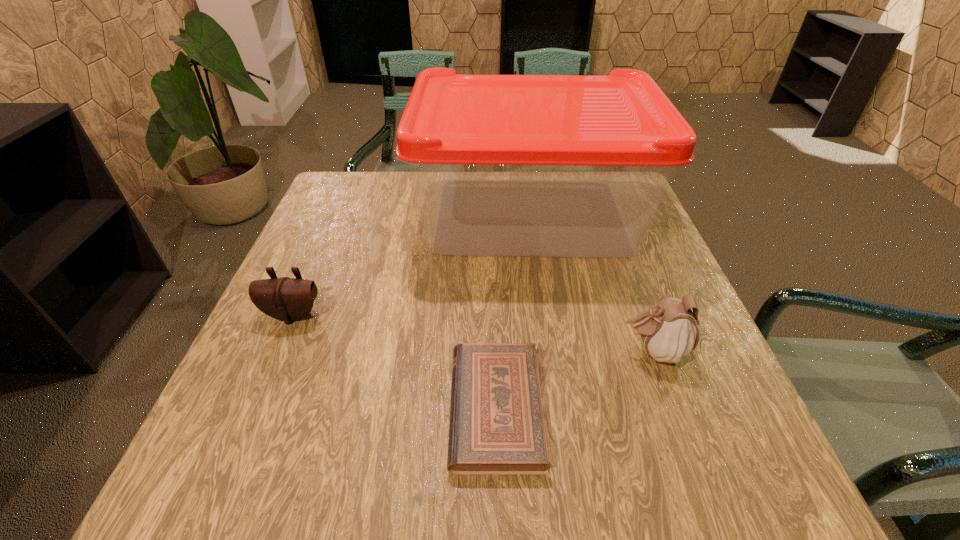
At what (x,y) coordinates should I click in order to perform the action: click on object at the far right corner. Please return your answer as a coordinate pair (x, y). Looking at the image, I should click on (503, 165).

This screenshot has height=540, width=960. I want to click on free space at the far edge of the desktop, so click(x=403, y=206).

Find the location of a particular element. The height and width of the screenshot is (540, 960). vacant space at the left edge of the desktop is located at coordinates (312, 363).

The image size is (960, 540). I want to click on vacant region at the right edge of the desktop, so click(635, 299).

In the image, there is a desktop. Where is `vacant space at the far left corner`? This screenshot has width=960, height=540. vacant space at the far left corner is located at coordinates (354, 185).

Locate an element on the screen. The height and width of the screenshot is (540, 960). vacant space at the near right corner of the desktop is located at coordinates (706, 469).

Where is `empty location between the taller pouch and the second shortest object`? empty location between the taller pouch and the second shortest object is located at coordinates (473, 333).

Locate an element on the screen. vacant space that is in between the second farthest object and the tray is located at coordinates (411, 265).

You are a GUI agent. You are given a task and a screenshot of the screen. Output one action in this format:
    pyautogui.click(x=<x>, y=<y>)
    Task: Click on the vacant space in between the farthest object and the shortest object
    The image size is (960, 540).
    Given the screenshot: What is the action you would take?
    pyautogui.click(x=513, y=312)

Find the location of a particular element. This screenshot has height=540, width=960. free space between the farthest object and the third tallest object is located at coordinates (411, 265).